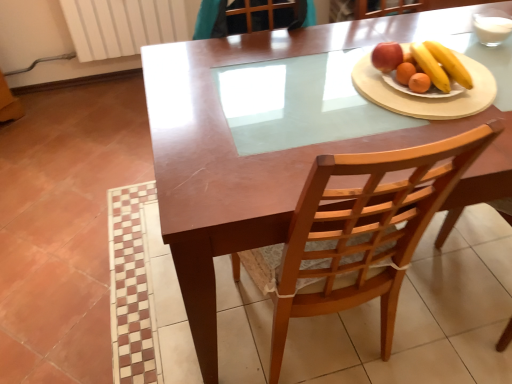
Question: Is smooth wooden plate with fruits at right taller or shorter than white ceramic plate at upper right?

Choices:
 (A) short
 (B) tall

Answer: (B)

Question: In the image, is smooth wooden plate with fruits at right on the left side or the right side of white ceramic plate at upper right?

Choices:
 (A) left
 (B) right

Answer: (B)

Question: Estimate the real-world distances between objects in this image. Which object is farther from the wooden chair at center?

Choices:
 (A) smooth wooden plate with fruits at right
 (B) white ceramic plate at upper right

Answer: (A)

Question: Estimate the real-world distances between objects in this image. Which object is closer to the smooth wooden plate with fruits at right?

Choices:
 (A) wooden chair at center
 (B) white ceramic plate at upper right

Answer: (B)